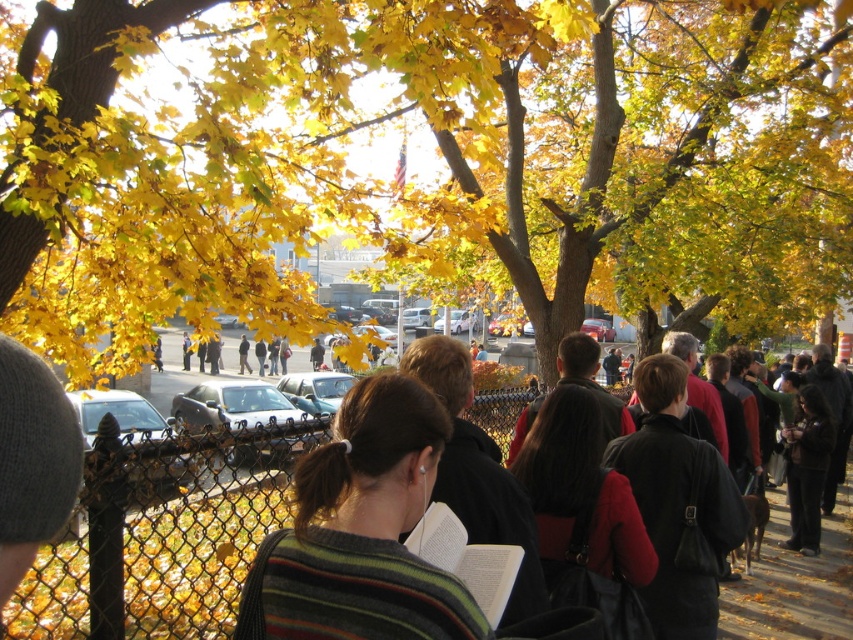
Question: Which point appears farthest from the camera in this image?

Choices:
 (A) (830, 572)
 (B) (390, 508)
 (C) (136, 6)

Answer: (A)

Question: Can you confirm if yellow leaves at upper center is positioned to the right of black chain-link fence at center?

Choices:
 (A) yes
 (B) no

Answer: (A)

Question: Does dark red fabric bag at center appear under dark brown leather jacket at lower right?

Choices:
 (A) no
 (B) yes

Answer: (A)

Question: Can you confirm if dark red fabric bag at center is positioned to the right of dark brown leather jacket at lower right?

Choices:
 (A) yes
 (B) no

Answer: (B)

Question: Which object is the closest to the dark red fabric bag at center?

Choices:
 (A) black chain-link fence at center
 (B) dark brown leather jacket at lower right

Answer: (A)

Question: Which object is farther from the camera taking this photo?

Choices:
 (A) black chain-link fence at center
 (B) dark red fabric bag at center

Answer: (B)